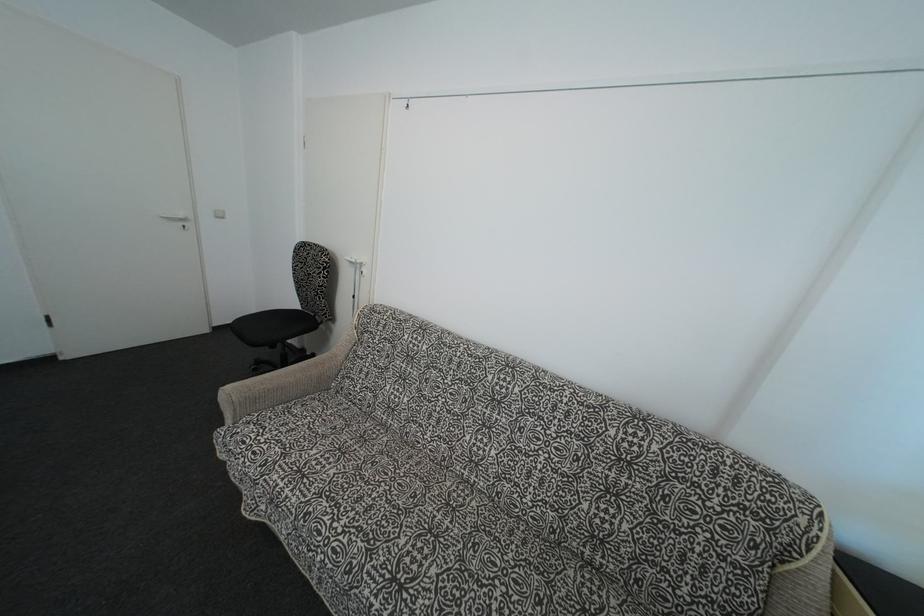
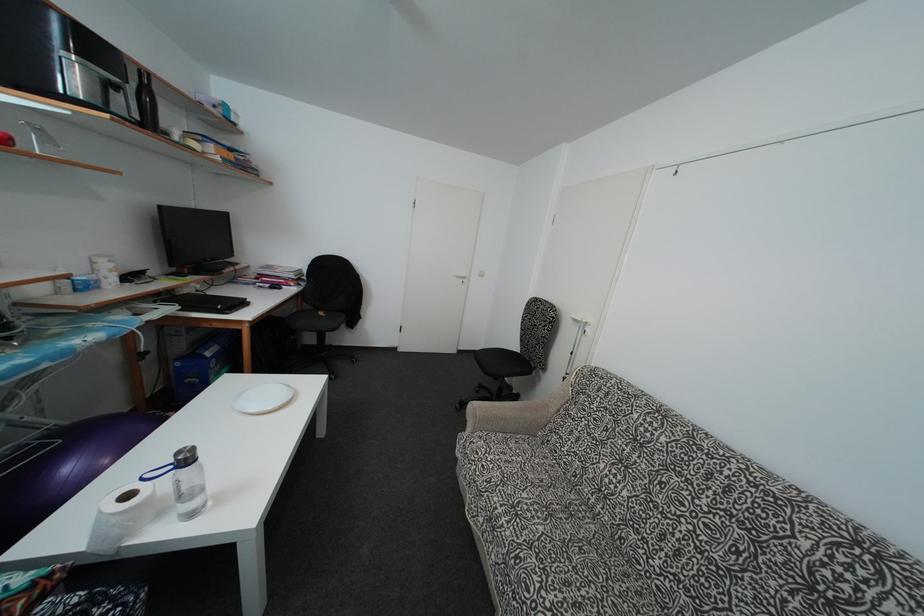
Where in the second image is the point corresponding to (x=297, y=310) from the first image?

(517, 353)